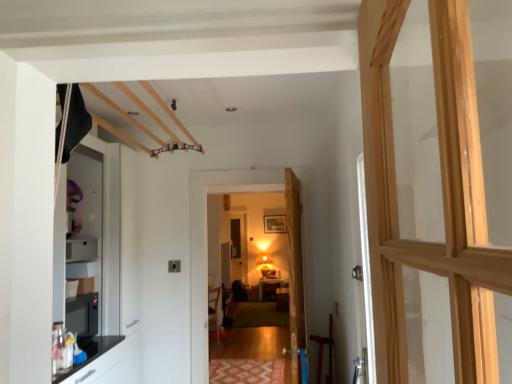
Question: Is point (285, 281) positioned closer to the camera than point (294, 304)?

Choices:
 (A) closer
 (B) farther

Answer: (B)

Question: Would you say matte wooden table at center is inside or outside wooden door at center, the 1th door positioned from the front?

Choices:
 (A) outside
 (B) inside

Answer: (A)

Question: Based on their relative distances, which object is farther from the wooden door at center, the 2th door when ordered from front to back?

Choices:
 (A) patterned carpet at center
 (B) matte wooden chair at center
 (C) wooden door at center, the 1th door positioned from the front
 (D) matte wooden table at center

Answer: (D)

Question: Which object is positioned farthest from the wooden door at center, the first door positioned from the back?

Choices:
 (A) patterned carpet at center
 (B) matte wooden chair at center
 (C) wooden door at center, the 1th door positioned from the front
 (D) matte wooden table at center

Answer: (D)